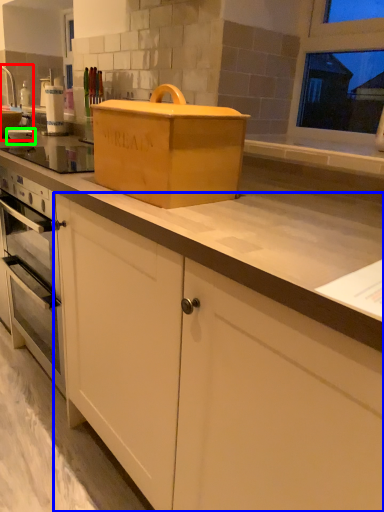
Question: Considering the real-world distances, which object is closest to sink (highlighted by a red box)? cabinetry (highlighted by a blue box) or appliance (highlighted by a green box).

Choices:
 (A) cabinetry
 (B) appliance

Answer: (B)